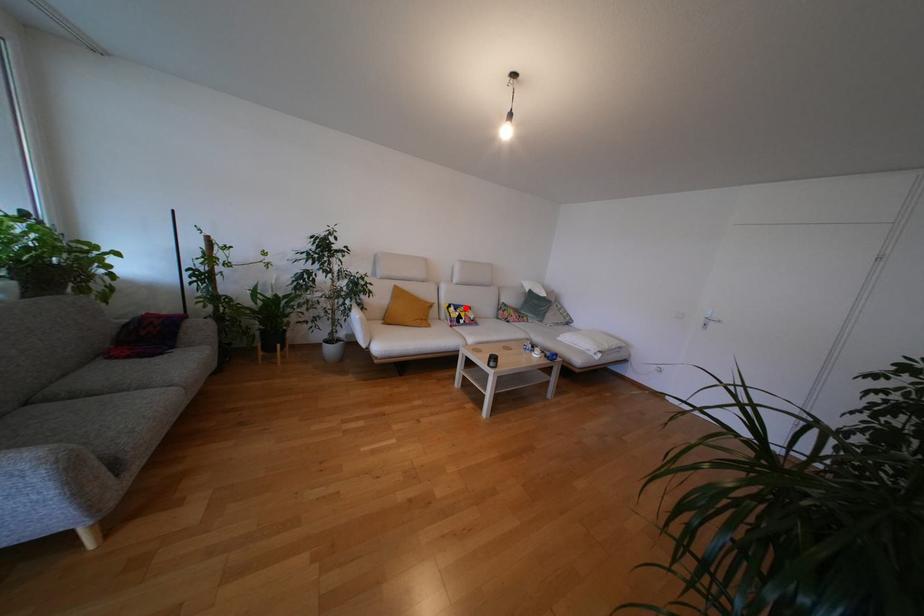
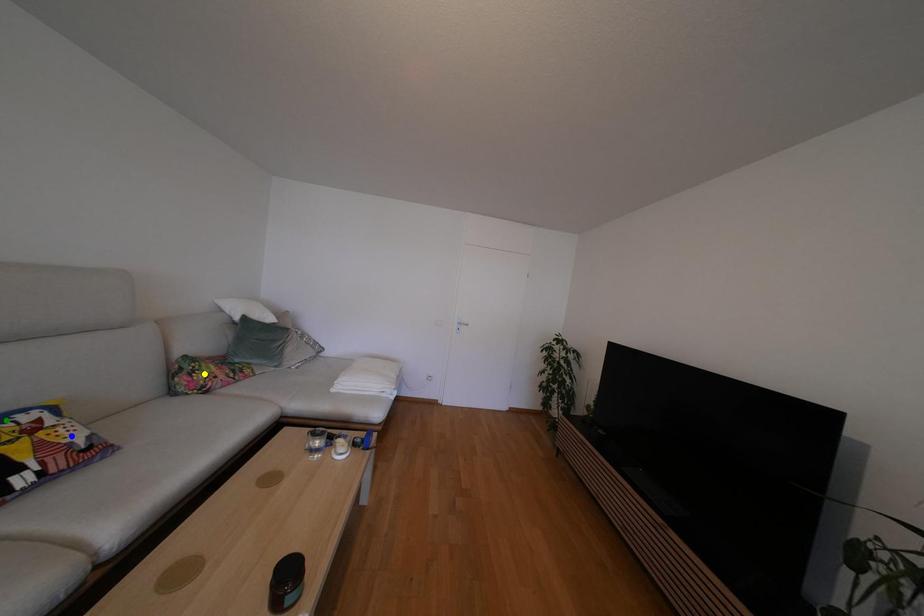
Question: I am providing you with two images of the same scene from different viewpoints. A red point is marked on the first image. You are given multiple points on the second image. Which mark in image 2 goes with the point in image 1?

Choices:
 (A) blue point
 (B) yellow point
 (C) green point

Answer: (C)